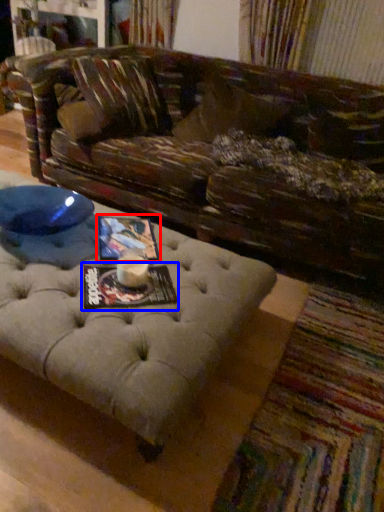
Question: Which object appears farthest to the camera in this image, magazine (highlighted by a red box) or magazine (highlighted by a blue box)?

Choices:
 (A) magazine
 (B) magazine

Answer: (A)